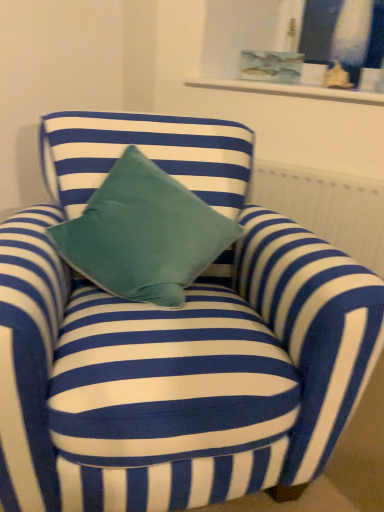
Measure the distance between white textured radiator at upper center and camera.

The depth of white textured radiator at upper center is 5.03 feet.

This screenshot has width=384, height=512. What do you see at coordinates (326, 207) in the screenshot?
I see `white textured radiator at upper center` at bounding box center [326, 207].

I want to click on white textured radiator at upper center, so click(326, 207).

The height and width of the screenshot is (512, 384). What do you see at coordinates (343, 38) in the screenshot?
I see `matte glass vase at upper right` at bounding box center [343, 38].

Image resolution: width=384 pixels, height=512 pixels. Identify the location of matte glass vase at upper right. tap(343, 38).

Identify the location of white textured radiator at upper center. The width and height of the screenshot is (384, 512). (326, 207).

In the scene shown: Considering the positions of objects white textured radiator at upper center and matte glass vase at upper right in the image provided, who is more to the left, white textured radiator at upper center or matte glass vase at upper right?

white textured radiator at upper center.

Is white textured radiator at upper center in front of or behind matte glass vase at upper right in the image?

Visually, white textured radiator at upper center is located in front of matte glass vase at upper right.

Is point (336, 198) closer or farther from the camera than point (381, 90)?

Point (336, 198) appears to be closer to the viewer than point (381, 90).

From the image's perspective, between white textured radiator at upper center and matte glass vase at upper right, which one is located above?

matte glass vase at upper right appears higher in the image.

From a real-world perspective, who is located higher, white textured radiator at upper center or matte glass vase at upper right?

matte glass vase at upper right is physically above.

Considering the relative sizes of white textured radiator at upper center and matte glass vase at upper right in the image provided, is white textured radiator at upper center thinner than matte glass vase at upper right?

In fact, white textured radiator at upper center might be wider than matte glass vase at upper right.

Consider the image. In terms of height, does white textured radiator at upper center look taller or shorter compared to matte glass vase at upper right?

white textured radiator at upper center is taller than matte glass vase at upper right.

Considering the sizes of objects white textured radiator at upper center and matte glass vase at upper right in the image provided, who is smaller, white textured radiator at upper center or matte glass vase at upper right?

matte glass vase at upper right.

Would you say white textured radiator at upper center is inside or outside matte glass vase at upper right?

white textured radiator at upper center lies outside matte glass vase at upper right.

Are white textured radiator at upper center and matte glass vase at upper right beside each other?

There is a gap between white textured radiator at upper center and matte glass vase at upper right.

Is matte glass vase at upper right at the back of white textured radiator at upper center?

No, matte glass vase at upper right is not at the back of white textured radiator at upper center.

What's the angular difference between white textured radiator at upper center and matte glass vase at upper right's facing directions?

2.06 degrees separate the facing orientations of white textured radiator at upper center and matte glass vase at upper right.

The image size is (384, 512). Identify the location of window above the white textured radiator at upper center (from the image's perspective). (343, 38).

Visually, is matte glass vase at upper right positioned to the left or to the right of white textured radiator at upper center?

From the image, it's evident that matte glass vase at upper right is to the right of white textured radiator at upper center.

Which object is closer to the camera taking this photo, matte glass vase at upper right or white textured radiator at upper center?

white textured radiator at upper center is more forward.

Does point (326, 86) come in front of point (365, 252)?

That is False.

In the scene shown: From the image's perspective, which is above, matte glass vase at upper right or white textured radiator at upper center?

From the image's view, matte glass vase at upper right is above.

From a real-world perspective, which object rests below the other?

white textured radiator at upper center.

Which of these two, matte glass vase at upper right or white textured radiator at upper center, is wider?

Wider between the two is white textured radiator at upper center.

Considering the sizes of objects matte glass vase at upper right and white textured radiator at upper center in the image provided, who is shorter, matte glass vase at upper right or white textured radiator at upper center?

With less height is matte glass vase at upper right.

Considering the relative sizes of matte glass vase at upper right and white textured radiator at upper center in the image provided, is matte glass vase at upper right bigger than white textured radiator at upper center?

No, matte glass vase at upper right is not bigger than white textured radiator at upper center.

Is matte glass vase at upper right positioned beyond the bounds of white textured radiator at upper center?

Absolutely, matte glass vase at upper right is external to white textured radiator at upper center.

Is matte glass vase at upper right positioned far away from white textured radiator at upper center?

Actually, matte glass vase at upper right and white textured radiator at upper center are a little close together.

Is matte glass vase at upper right turned away from white textured radiator at upper center?

matte glass vase at upper right does not have its back to white textured radiator at upper center.

How different are the orientations of matte glass vase at upper right and white textured radiator at upper center in degrees?

The facing directions of matte glass vase at upper right and white textured radiator at upper center are 2.06 degrees apart.

Based on the photo, how distant is matte glass vase at upper right from white textured radiator at upper center?

They are 22.63 inches apart.

The width and height of the screenshot is (384, 512). In the image, there is a white textured radiator at upper center. What are the coordinates of `window above it (from the image's perspective)` in the screenshot? It's located at (343, 38).

Find the location of a particular element. window behind the white textured radiator at upper center is located at coordinates (343, 38).

Image resolution: width=384 pixels, height=512 pixels. Identify the location of window above the white textured radiator at upper center (from the image's perspective). (343, 38).